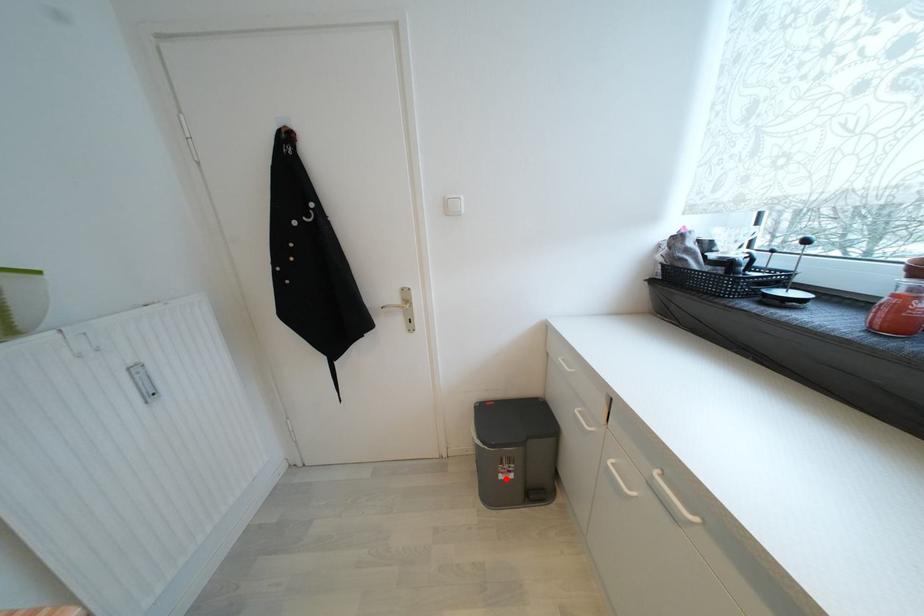
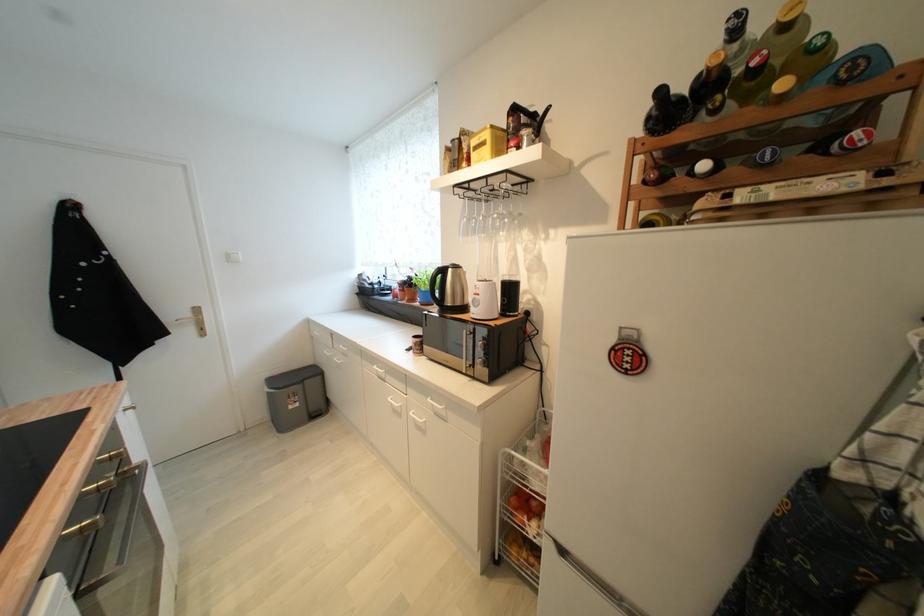
Locate, in the second image, the point that corresponds to the highlighted location in the first image.

(296, 408)